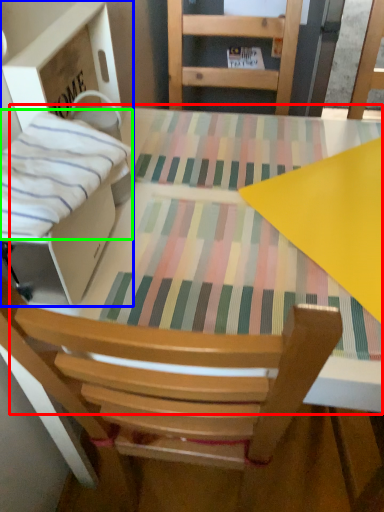
Question: Estimate the real-world distances between objects in this image. Which object is farther from round table (highlighted by a red box), cardboard box (highlighted by a blue box) or blanket (highlighted by a green box)?

Choices:
 (A) cardboard box
 (B) blanket

Answer: (B)